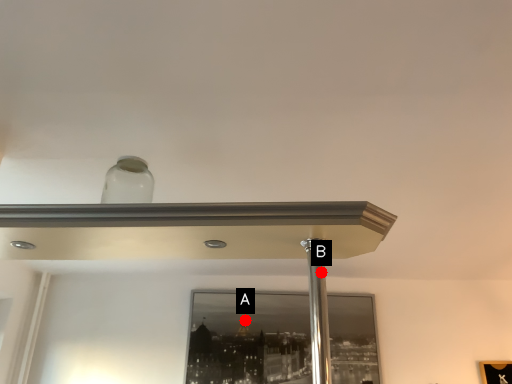
Question: Two points are circled on the image, labeled by A and B beside each circle. Among these points, which one is farthest from the camera?

Choices:
 (A) A is further
 (B) B is further

Answer: (A)